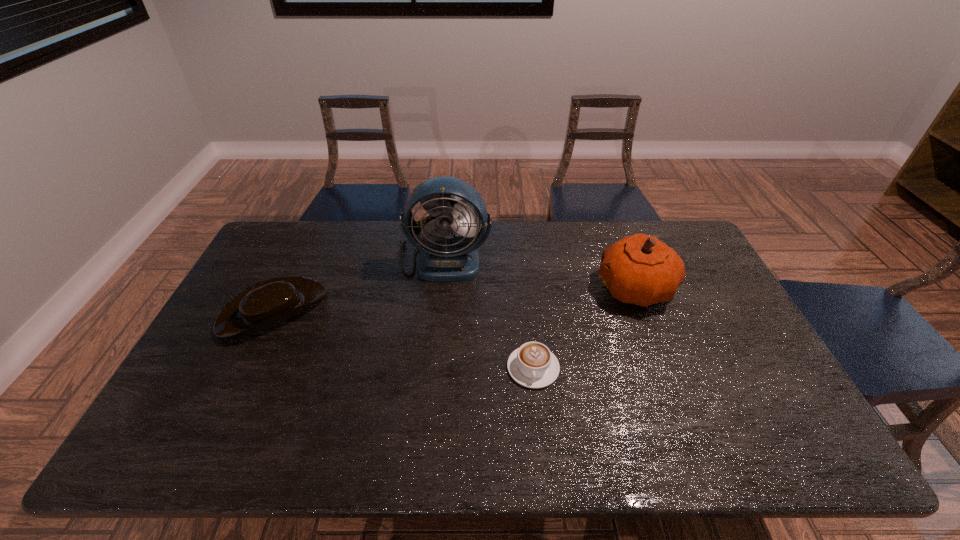
Find the location of `fan`. fan is located at coordinates (441, 259).

At what (x,y) coordinates should I click in order to perform the action: click on the tallest object. Please return your answer as a coordinate pair (x, y). The height and width of the screenshot is (540, 960). Looking at the image, I should click on (441, 259).

The image size is (960, 540). Find the location of `the rightmost object`. the rightmost object is located at coordinates (643, 270).

Identify the location of pumpkin. The image size is (960, 540). (643, 270).

Image resolution: width=960 pixels, height=540 pixels. What are the coordinates of `cowboy hat` in the screenshot? It's located at (262, 306).

Identify the location of the second shortest object. The image size is (960, 540). (262, 306).

The height and width of the screenshot is (540, 960). I want to click on the second object from right to left, so pos(533,365).

The image size is (960, 540). I want to click on the nearest object, so click(x=533, y=365).

The height and width of the screenshot is (540, 960). I want to click on vacant region located 0.360m in front of the second object from left to right to blow air, so tap(433, 375).

I want to click on vacant space situated 0.280m on the front-facing side of the pumpkin, so click(507, 288).